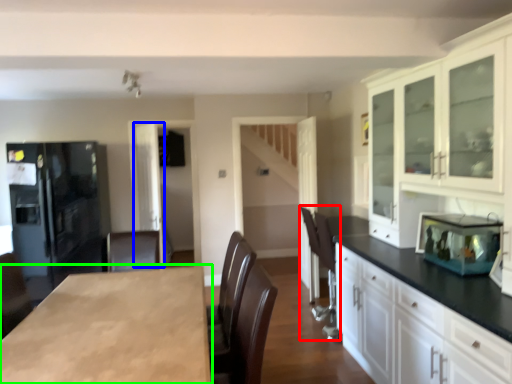
Question: Which object is positioned closest to armchair (highlighted by a red box)? Select from glass door (highlighted by a blue box) and countertop (highlighted by a green box).

Choices:
 (A) glass door
 (B) countertop

Answer: (B)